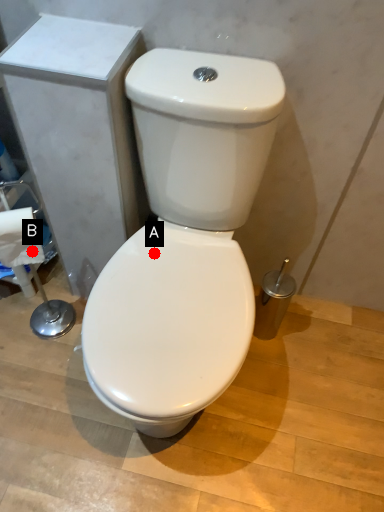
Question: Two points are circled on the image, labeled by A and B beside each circle. Which point appears closest to the camera in this image?

Choices:
 (A) A is closer
 (B) B is closer

Answer: (B)